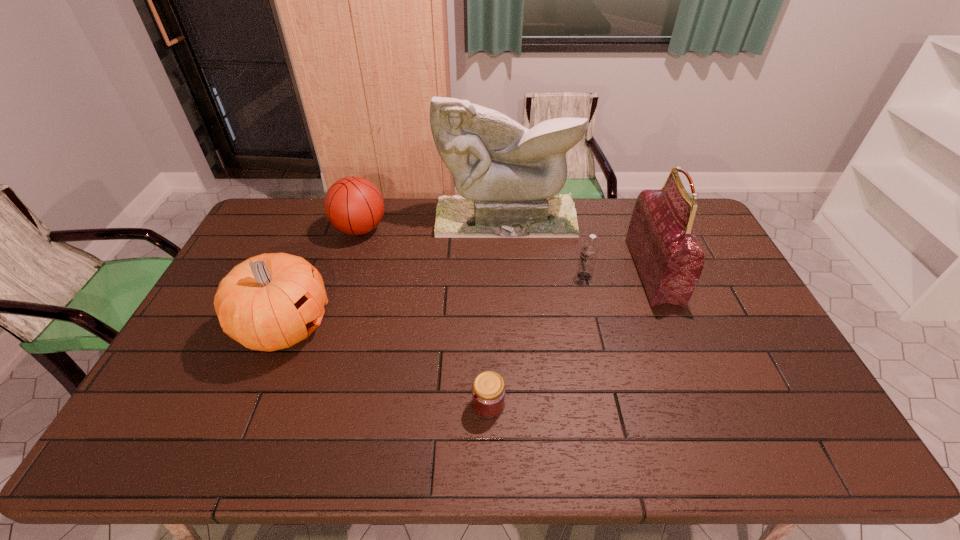
You are a GUI agent. You are given a task and a screenshot of the screen. Output one action in this format:
    pyautogui.click(x=<x>, y=<y>)
    Task: Click on the object positioned at the left edge
    This screenshot has width=960, height=540.
    Given the screenshot: What is the action you would take?
    pyautogui.click(x=273, y=301)

What are the coordinates of `vacant area at the far edge` in the screenshot? It's located at (603, 210).

The height and width of the screenshot is (540, 960). I want to click on vacant space at the near edge of the desktop, so click(x=398, y=445).

At what (x,y) coordinates should I click in order to perform the action: click on vacant space at the right edge. Please return your answer as a coordinate pair (x, y). Image resolution: width=960 pixels, height=540 pixels. Looking at the image, I should click on (701, 238).

The height and width of the screenshot is (540, 960). Identify the location of vacant area at the near left corner of the desktop. (197, 436).

The image size is (960, 540). Identify the location of empty space that is in between the sculpture and the pumpkin. (396, 273).

Locate an element on the screen. This screenshot has width=960, height=540. unoccupied area between the tallest object and the pumpkin is located at coordinates (396, 273).

The height and width of the screenshot is (540, 960). I want to click on unoccupied area between the rightmost object and the sculpture, so click(x=579, y=245).

Where is `empty space between the fifth tallest object and the sculpture`? empty space between the fifth tallest object and the sculpture is located at coordinates (545, 247).

Identify the location of empty space between the rightmost object and the vodka. (618, 274).